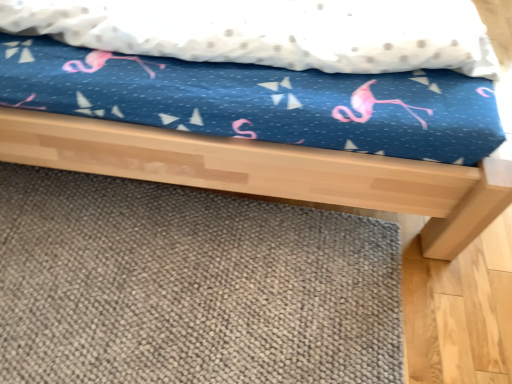
Image resolution: width=512 pixels, height=384 pixels. What do you see at coordinates (189, 286) in the screenshot?
I see `gray textured mat at lower center` at bounding box center [189, 286].

Measure the distance between point (14, 347) and camera.

Point (14, 347) and camera are 1.08 meters apart from each other.

Identify the location of gray textured mat at lower center. (189, 286).

Describe the element at coordinates (269, 171) in the screenshot. Image resolution: width=512 pixels, height=384 pixels. I see `blue fabric bed at center` at that location.

What are the coordinates of `blue fabric bed at center` in the screenshot? It's located at (269, 171).

The width and height of the screenshot is (512, 384). I want to click on gray textured mat at lower center, so click(189, 286).

Between gray textured mat at lower center and blue fabric bed at center, which one appears on the right side from the viewer's perspective?

From the viewer's perspective, gray textured mat at lower center appears more on the right side.

Is gray textured mat at lower center in front of or behind blue fabric bed at center in the image?

Clearly, gray textured mat at lower center is behind blue fabric bed at center.

Which point is more distant from viewer, (239, 237) or (247, 151)?

The point (239, 237) is more distant.

From the image's perspective, which object appears higher, gray textured mat at lower center or blue fabric bed at center?

blue fabric bed at center is shown above in the image.

From a real-world perspective, which is physically below, gray textured mat at lower center or blue fabric bed at center?

From a 3D spatial view, gray textured mat at lower center is below.

Which object is thinner, gray textured mat at lower center or blue fabric bed at center?

With smaller width is gray textured mat at lower center.

Considering the relative sizes of gray textured mat at lower center and blue fabric bed at center in the image provided, is gray textured mat at lower center taller than blue fabric bed at center?

In fact, gray textured mat at lower center may be shorter than blue fabric bed at center.

Does gray textured mat at lower center have a larger size compared to blue fabric bed at center?

Actually, gray textured mat at lower center might be smaller than blue fabric bed at center.

Can we say gray textured mat at lower center lies outside blue fabric bed at center?

Yes, gray textured mat at lower center is located beyond the bounds of blue fabric bed at center.

Are gray textured mat at lower center and blue fabric bed at center located far from each other?

No, gray textured mat at lower center is not far away from blue fabric bed at center.

Is gray textured mat at lower center facing away from blue fabric bed at center?

No.

I want to click on bed on the left of the gray textured mat at lower center, so click(269, 171).

Between blue fabric bed at center and gray textured mat at lower center, which one appears on the left side from the viewer's perspective?

blue fabric bed at center is more to the left.

Considering their positions, is blue fabric bed at center located in front of or behind gray textured mat at lower center?

Clearly, blue fabric bed at center is in front of gray textured mat at lower center.

From the picture: Which is less distant, (460, 241) or (265, 250)?

The point (460, 241) is in front.

From the image's perspective, is blue fabric bed at center above gray textured mat at lower center?

Indeed, from the image's perspective, blue fabric bed at center is shown above gray textured mat at lower center.

From a real-world perspective, is blue fabric bed at center positioned under gray textured mat at lower center based on gravity?

No, from a real-world perspective, blue fabric bed at center is not under gray textured mat at lower center.

Which object is thinner, blue fabric bed at center or gray textured mat at lower center?

Thinner between the two is gray textured mat at lower center.

From the picture: Considering the sizes of blue fabric bed at center and gray textured mat at lower center in the image, is blue fabric bed at center taller or shorter than gray textured mat at lower center?

blue fabric bed at center is taller than gray textured mat at lower center.

Based on their sizes in the image, would you say blue fabric bed at center is bigger or smaller than gray textured mat at lower center?

Clearly, blue fabric bed at center is larger in size than gray textured mat at lower center.

Which is correct: blue fabric bed at center is inside gray textured mat at lower center, or outside of it?

blue fabric bed at center is spatially situated outside gray textured mat at lower center.

Is there a large distance between blue fabric bed at center and gray textured mat at lower center?

blue fabric bed at center is actually quite close to gray textured mat at lower center.

Consider the image. Could you tell me if blue fabric bed at center is turned towards gray textured mat at lower center?

No, blue fabric bed at center is not turned towards gray textured mat at lower center.

I want to click on bed above the gray textured mat at lower center (from the image's perspective), so click(x=269, y=171).

Find the location of a particular element. This screenshot has width=512, height=384. bed above the gray textured mat at lower center (from the image's perspective) is located at coordinates (269, 171).

The height and width of the screenshot is (384, 512). Identify the location of mat behind the blue fabric bed at center. (189, 286).